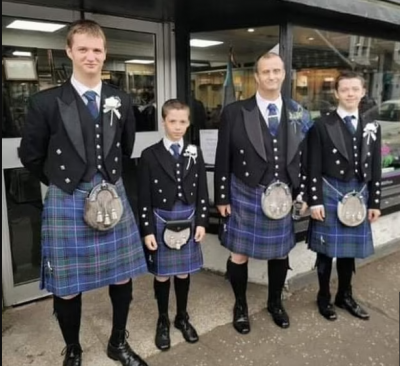
At what (x,y) coordinates should I click in order to perform the action: click on glass. Please return your answer as a coordinate pair (x, y). Image resolution: width=400 pixels, height=366 pixels. Looking at the image, I should click on (333, 56).